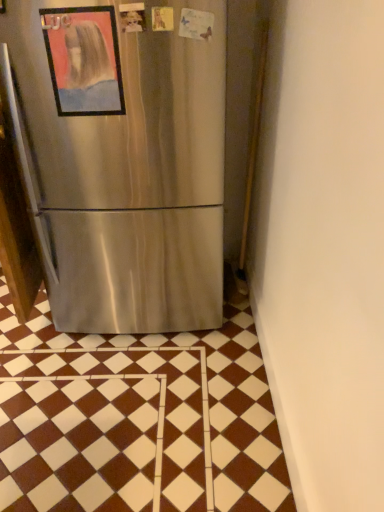
Locate an element on the screen. The height and width of the screenshot is (512, 384). vacant area on top of brown glossy tile at center (from a real-world perspective) is located at coordinates (115, 378).